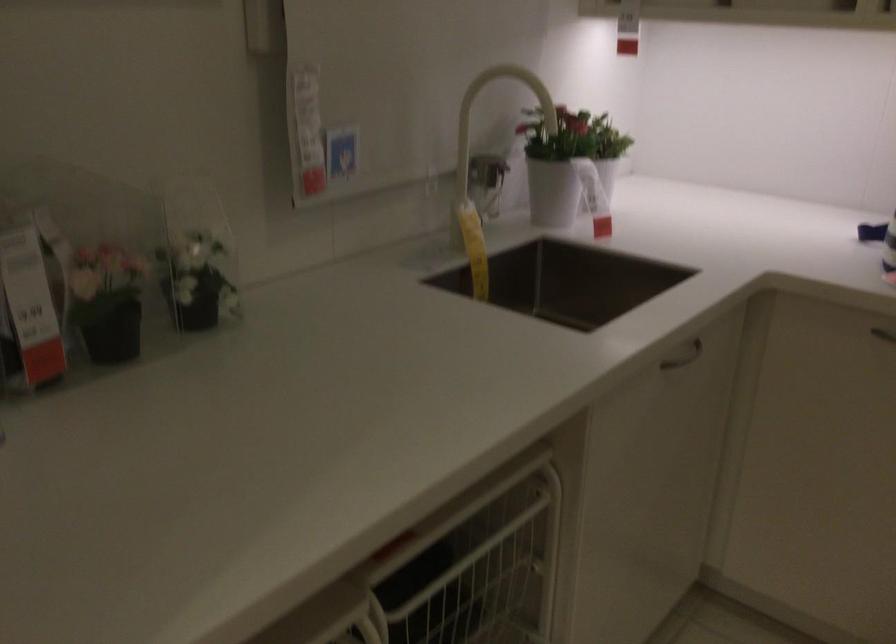
At what (x,y) coordinates should I click in order to perform the action: click on cabinet handle. Please return your answer as a coordinate pair (x, y). This screenshot has width=896, height=644. Looking at the image, I should click on (683, 357).